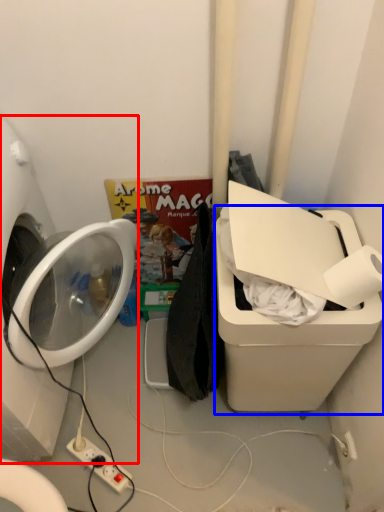
Question: Among these objects, which one is nearest to the camera, washing machine (highlighted by a red box) or water cooler (highlighted by a blue box)?

Choices:
 (A) washing machine
 (B) water cooler

Answer: (A)